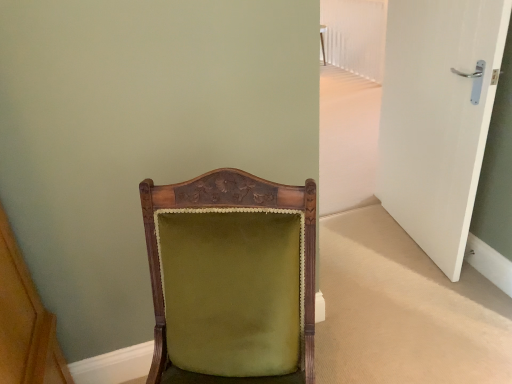
The image size is (512, 384). What are the coordinates of `unoccupied area in front of white glossy door at right` in the screenshot? It's located at (431, 297).